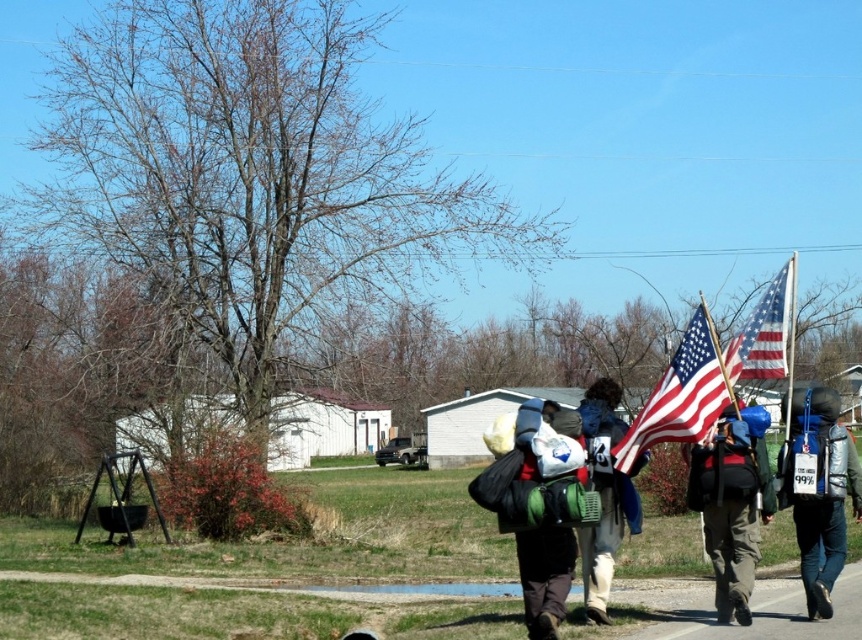
Who is higher up, matte black backpack at center or blue fabric backpack at center?

Positioned higher is matte black backpack at center.

Can you confirm if matte black backpack at center is positioned to the left of blue fabric backpack at center?

In fact, matte black backpack at center is to the right of blue fabric backpack at center.

Measure the distance between point (700, 506) and camera.

Point (700, 506) and camera are 10.71 meters apart.

Where is `matte black backpack at center`? This screenshot has height=640, width=862. matte black backpack at center is located at coordinates (732, 502).

You are a GUI agent. You are given a task and a screenshot of the screen. Output one action in this format:
    pyautogui.click(x=<x>, y=<y>)
    Task: Click on the matte black backpack at center
    The height and width of the screenshot is (640, 862).
    Given the screenshot: What is the action you would take?
    pyautogui.click(x=732, y=502)

Between matte black backpack at center and matte green backpack at center, which one is positioned higher?

matte black backpack at center

Locate an element on the screen. matte black backpack at center is located at coordinates (732, 502).

Between silver metallic backpack at right and american flag at center, which one is positioned higher?

american flag at center is higher up.

Which is more to the left, silver metallic backpack at right or american flag at center?

american flag at center

Where is `silver metallic backpack at right`? This screenshot has height=640, width=862. silver metallic backpack at right is located at coordinates (817, 488).

Locate an element on the screen. The height and width of the screenshot is (640, 862). silver metallic backpack at right is located at coordinates (817, 488).